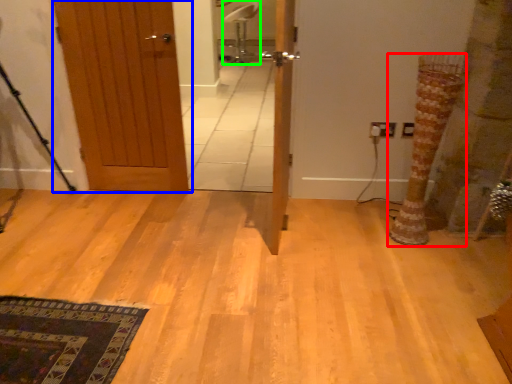
Question: Which object is positioned farthest from tree trunk (highlighted by a red box)? Select from door (highlighted by a blue box) and chair (highlighted by a green box).

Choices:
 (A) door
 (B) chair

Answer: (B)